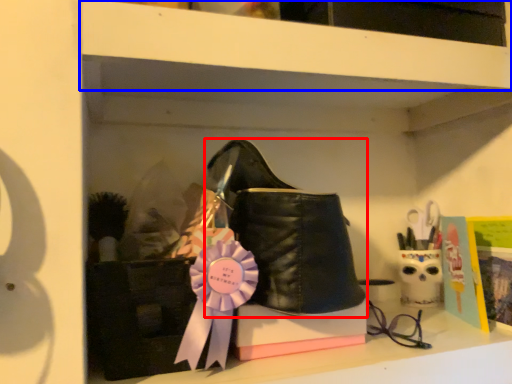
Question: Which point is closer to the camera, footwear (highlighted by a red box) or shelf (highlighted by a blue box)?

Choices:
 (A) footwear
 (B) shelf

Answer: (B)